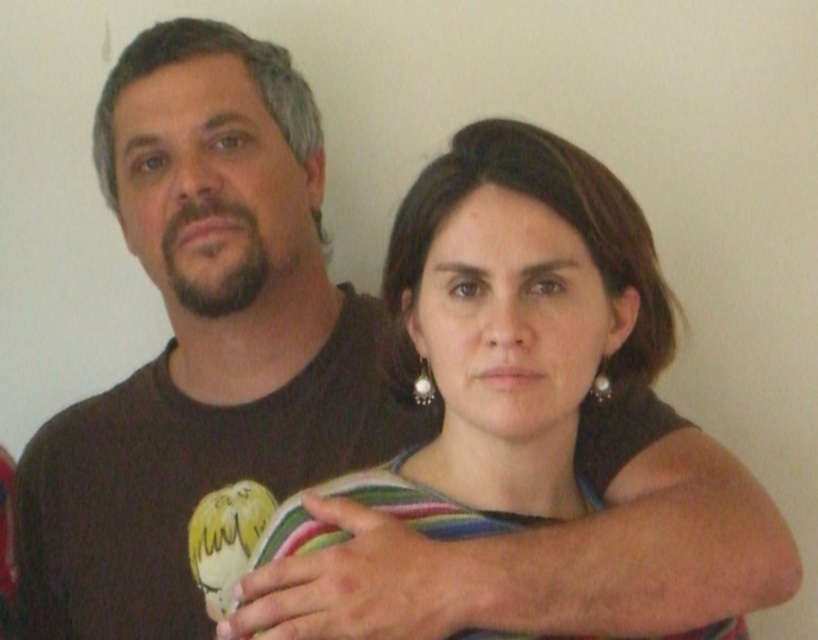
Which is in front, point (250, 468) or point (457, 240)?

Positioned in front is point (457, 240).

In order to click on dark brown t-shirt at center in this screenshot , I will do `click(201, 348)`.